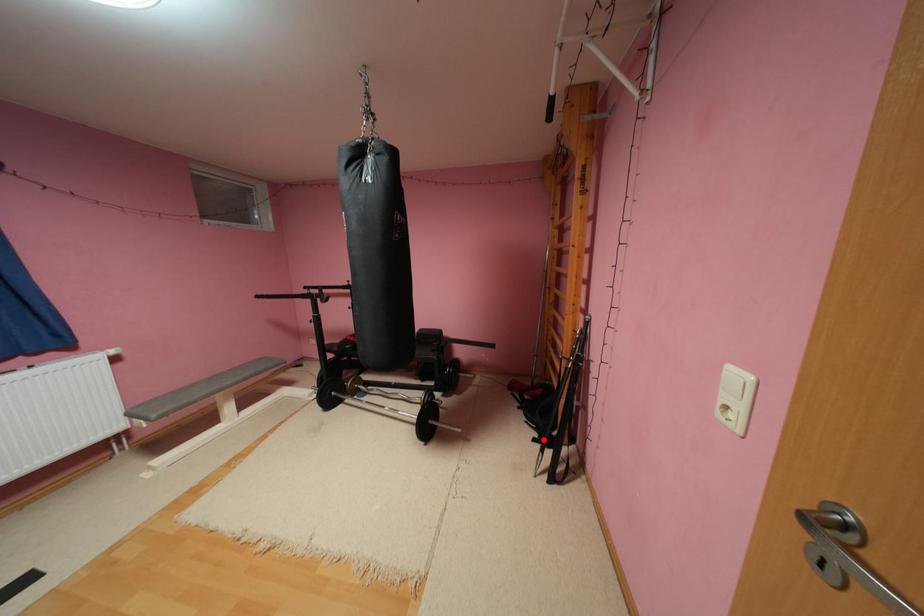
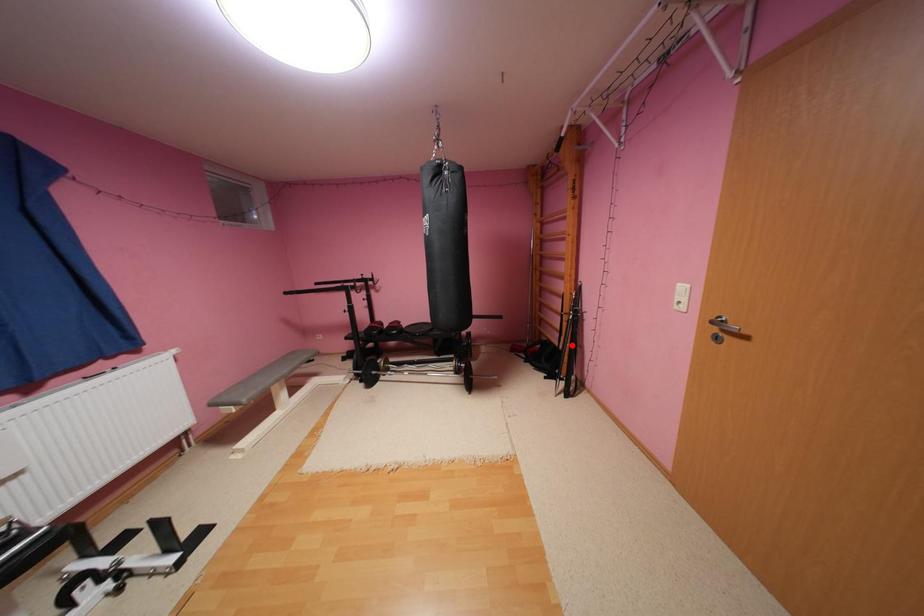
I am providing you with two images of the same scene from different viewpoints. A red point is marked on the first image and another point is marked on the second image. Does the point marked in image1 correspond to the same location as the one in image2?

No